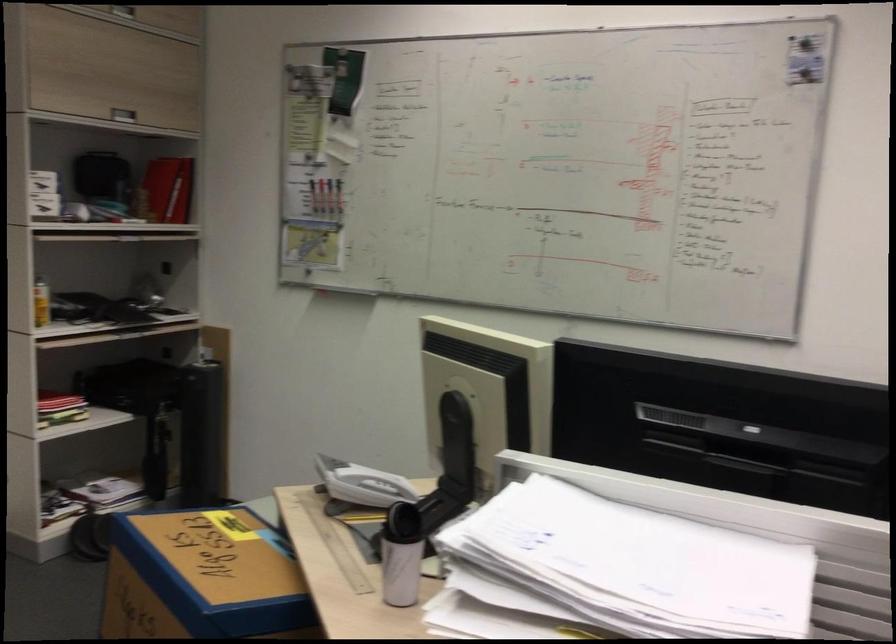
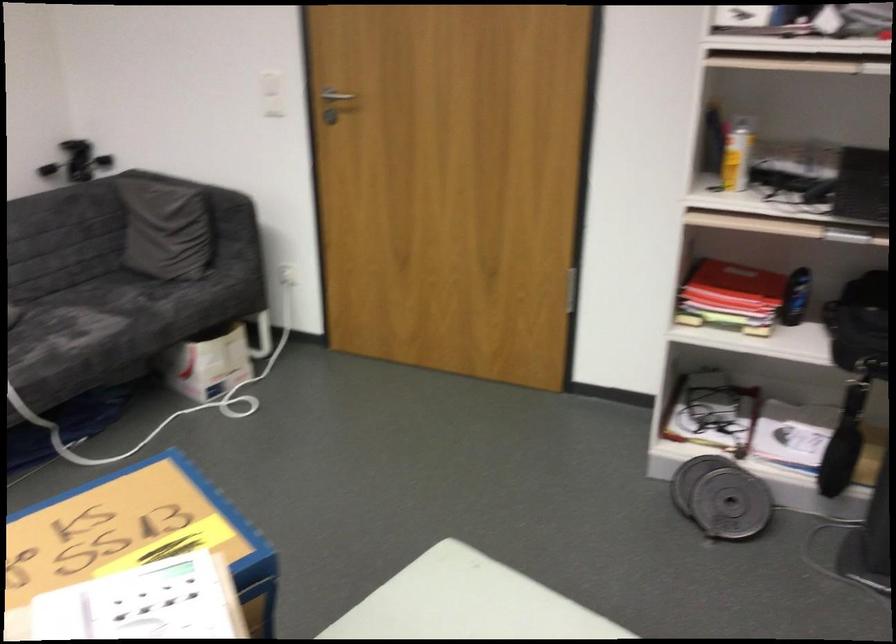
Find the pixel in the second image that matches (87,393) in the first image.

(796, 297)